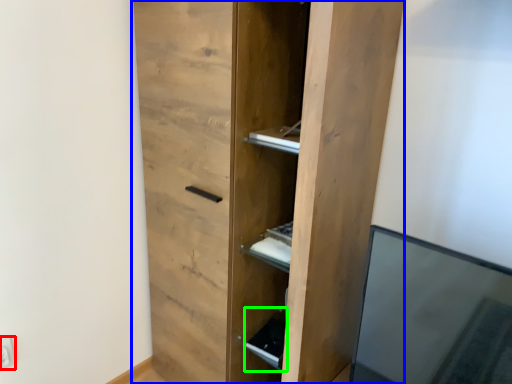
Question: Which is farther away from electric outlet (highlighted by a red box)? cupboard (highlighted by a blue box) or cabinet (highlighted by a green box)?

Choices:
 (A) cupboard
 (B) cabinet

Answer: (A)